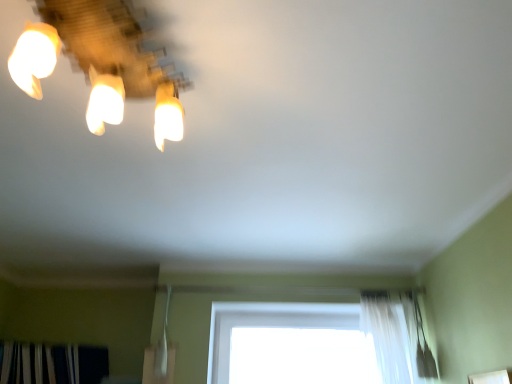
Question: In terms of width, does white sheer curtain at lower right look wider or thinner when compared to matte glass lamp at upper left?

Choices:
 (A) wide
 (B) thin

Answer: (B)

Question: Is white sheer curtain at lower right taller or shorter than matte glass lamp at upper left?

Choices:
 (A) tall
 (B) short

Answer: (A)

Question: Estimate the real-world distances between objects in this image. Which object is closer to the matte glass lamp at upper left?

Choices:
 (A) white sheer curtain at lower right
 (B) dark green textured curtain at lower left

Answer: (A)

Question: Estimate the real-world distances between objects in this image. Which object is farther from the white sheer curtain at lower right?

Choices:
 (A) dark green textured curtain at lower left
 (B) matte glass lamp at upper left

Answer: (B)